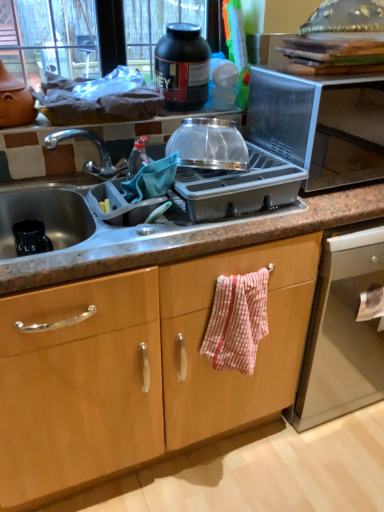
You are a GUI agent. You are given a task and a screenshot of the screen. Output one action in this format:
    pyautogui.click(x=<x>, y=<y>)
    Task: Click on the red and white checkered fabric at center
    The width and height of the screenshot is (384, 512).
    Given the screenshot: What is the action you would take?
    pyautogui.click(x=237, y=321)

Measure the distance between point (211,143) and camera.

A distance of 1.14 meters exists between point (211,143) and camera.

What is the approximate height of transparent plastic microwave at upper right?

transparent plastic microwave at upper right is 34.13 centimeters in height.

The image size is (384, 512). Identify the location of transparent plastic microwave at upper right. (320, 125).

Identify the location of red and white checkered fabric at center. Image resolution: width=384 pixels, height=512 pixels. (237, 321).

In the scene shown: From a real-world perspective, does black plastic jar at upper center, positioned as the 2th kitchen appliance in bottom-to-top order, sit lower than red and white checkered fabric at center?

Actually, black plastic jar at upper center, positioned as the 2th kitchen appliance in bottom-to-top order, is physically above red and white checkered fabric at center in the real world.

How different are the orientations of black plastic jar at upper center, the first kitchen appliance positioned from the back, and red and white checkered fabric at center in degrees?

1.8 degrees separate the facing orientations of black plastic jar at upper center, the first kitchen appliance positioned from the back, and red and white checkered fabric at center.

Could you tell me if black plastic jar at upper center, which ranks as the second kitchen appliance in front-to-back order, is facing red and white checkered fabric at center?

No, black plastic jar at upper center, which ranks as the second kitchen appliance in front-to-back order, is not aimed at red and white checkered fabric at center.

Can red and white checkered fabric at center be found inside black plastic jar at upper center, which ranks as the second kitchen appliance in front-to-back order?

Actually, red and white checkered fabric at center is outside black plastic jar at upper center, which ranks as the second kitchen appliance in front-to-back order.

From a real-world perspective, is black plastic jar at upper center, positioned as the 2th kitchen appliance in bottom-to-top order, physically located above or below granite gray sink at center?

In terms of real-world spatial position, black plastic jar at upper center, positioned as the 2th kitchen appliance in bottom-to-top order, is above granite gray sink at center.

Considering the sizes of objects black plastic jar at upper center, the first kitchen appliance viewed from the top, and granite gray sink at center in the image provided, who is taller, black plastic jar at upper center, the first kitchen appliance viewed from the top, or granite gray sink at center?

With more height is black plastic jar at upper center, the first kitchen appliance viewed from the top.

Is black plastic jar at upper center, which ranks as the second kitchen appliance in front-to-back order, facing towards granite gray sink at center?

No, black plastic jar at upper center, which ranks as the second kitchen appliance in front-to-back order, is not oriented towards granite gray sink at center.

Which is more to the left, black plastic jar at upper center, the first kitchen appliance viewed from the top, or granite gray sink at center?

From the viewer's perspective, granite gray sink at center appears more on the left side.

Considering the sizes of red and white checkered fabric at center and granite gray sink at center in the image, is red and white checkered fabric at center wider or thinner than granite gray sink at center?

Considering their sizes, red and white checkered fabric at center looks slimmer than granite gray sink at center.

Is red and white checkered fabric at center inside the boundaries of granite gray sink at center, or outside?

red and white checkered fabric at center cannot be found inside granite gray sink at center.

Who is taller, red and white checkered fabric at center or granite gray sink at center?

Standing taller between the two is red and white checkered fabric at center.

From the image's perspective, between black plastic jar at upper center, the first kitchen appliance positioned from the back, and transparent plastic bowl at upper center, the first kitchen appliance ordered from the bottom, which one is located above?

From the image's view, black plastic jar at upper center, the first kitchen appliance positioned from the back, is above.

Measure the distance between black plastic jar at upper center, positioned as the 2th kitchen appliance in bottom-to-top order, and transparent plastic bowl at upper center, the first kitchen appliance ordered from the bottom.

The distance of black plastic jar at upper center, positioned as the 2th kitchen appliance in bottom-to-top order, from transparent plastic bowl at upper center, the first kitchen appliance ordered from the bottom, is 10.14 inches.

Does black plastic jar at upper center, the first kitchen appliance viewed from the top, touch transparent plastic bowl at upper center, the second kitchen appliance in the back-to-front sequence?

There is a gap between black plastic jar at upper center, the first kitchen appliance viewed from the top, and transparent plastic bowl at upper center, the second kitchen appliance in the back-to-front sequence.

Is granite gray sink at center far away from black plastic jar at upper center, the first kitchen appliance positioned from the back?

They are positioned close to each other.

Does granite gray sink at center have a lesser width compared to black plastic jar at upper center, the first kitchen appliance viewed from the top?

No, granite gray sink at center is not thinner than black plastic jar at upper center, the first kitchen appliance viewed from the top.

From the image's perspective, is granite gray sink at center located beneath black plastic jar at upper center, which ranks as the second kitchen appliance in front-to-back order?

Yes, from the image's perspective, granite gray sink at center is beneath black plastic jar at upper center, which ranks as the second kitchen appliance in front-to-back order.

Based on the photo, can you confirm if granite gray sink at center is taller than black plastic jar at upper center, the first kitchen appliance viewed from the top?

No, granite gray sink at center is not taller than black plastic jar at upper center, the first kitchen appliance viewed from the top.

Is the position of transparent plastic microwave at upper right less distant than that of transparent plastic bowl at upper center, the second kitchen appliance in the back-to-front sequence?

No, transparent plastic microwave at upper right is further to the viewer.

Does transparent plastic microwave at upper right touch transparent plastic bowl at upper center, arranged as the 2th kitchen appliance when viewed from the top?

transparent plastic microwave at upper right and transparent plastic bowl at upper center, arranged as the 2th kitchen appliance when viewed from the top, are not in contact.

Which of these two, transparent plastic microwave at upper right or transparent plastic bowl at upper center, which is the first kitchen appliance from front to back, stands shorter?

transparent plastic bowl at upper center, which is the first kitchen appliance from front to back.

There is a transparent plastic microwave at upper right. At what (x,y) coordinates should I click in order to perform the action: click on the 1st kitchen appliance above it (from a real-world perspective). Please return your answer as a coordinate pair (x, y). The image size is (384, 512). Looking at the image, I should click on (208, 145).

Is transparent plastic microwave at upper right in contact with granite gray sink at center?

No, transparent plastic microwave at upper right is not next to granite gray sink at center.

Measure the distance from transparent plastic microwave at upper right to granite gray sink at center.

A distance of 15.97 inches exists between transparent plastic microwave at upper right and granite gray sink at center.

Considering the sizes of objects transparent plastic microwave at upper right and granite gray sink at center in the image provided, who is bigger, transparent plastic microwave at upper right or granite gray sink at center?

granite gray sink at center is bigger.

Considering the relative positions of transparent plastic microwave at upper right and granite gray sink at center in the image provided, is transparent plastic microwave at upper right behind granite gray sink at center?

Yes, transparent plastic microwave at upper right is further from the camera.

Find the location of a particular element. Image resolution: width=384 pixels, height=512 pixels. hand towel that is below the black plastic jar at upper center, which ranks as the second kitchen appliance in front-to-back order (from the image's perspective) is located at coordinates (237, 321).

Locate an element on the screen. The height and width of the screenshot is (512, 384). countertop in front of the black plastic jar at upper center, the first kitchen appliance positioned from the back is located at coordinates (192, 241).

Considering their positions, is red and white checkered fabric at center positioned closer to transparent plastic bowl at upper center, the second kitchen appliance in the back-to-front sequence, than black plastic jar at upper center, which ranks as the second kitchen appliance in front-to-back order?

black plastic jar at upper center, which ranks as the second kitchen appliance in front-to-back order, is closer to transparent plastic bowl at upper center, the second kitchen appliance in the back-to-front sequence.

When comparing their distances from transparent plastic bowl at upper center, arranged as the 2th kitchen appliance when viewed from the top, does granite gray sink at center or transparent plastic microwave at upper right seem closer?

Based on the image, granite gray sink at center appears to be nearer to transparent plastic bowl at upper center, arranged as the 2th kitchen appliance when viewed from the top.

From the image, which object appears to be farther from granite gray sink at center, black plastic jar at upper center, which ranks as the second kitchen appliance in front-to-back order, or transparent plastic microwave at upper right?

Based on the image, black plastic jar at upper center, which ranks as the second kitchen appliance in front-to-back order, appears to be further to granite gray sink at center.

Based on their spatial positions, is granite gray sink at center or black plastic jar at upper center, which ranks as the second kitchen appliance in front-to-back order, further from transparent plastic microwave at upper right?

Among the two, black plastic jar at upper center, which ranks as the second kitchen appliance in front-to-back order, is located further to transparent plastic microwave at upper right.

Consider the image. Which object lies nearer to the anchor point transparent plastic bowl at upper center, arranged as the 2th kitchen appliance when viewed from the top, black plastic jar at upper center, positioned as the 2th kitchen appliance in bottom-to-top order, or granite gray sink at center?

The object closer to transparent plastic bowl at upper center, arranged as the 2th kitchen appliance when viewed from the top, is black plastic jar at upper center, positioned as the 2th kitchen appliance in bottom-to-top order.

Estimate the real-world distances between objects in this image. Which object is further from red and white checkered fabric at center, black plastic jar at upper center, the first kitchen appliance positioned from the back, or transparent plastic bowl at upper center, which is the first kitchen appliance from front to back?

black plastic jar at upper center, the first kitchen appliance positioned from the back, is positioned further to the anchor red and white checkered fabric at center.

Based on their spatial positions, is transparent plastic microwave at upper right or red and white checkered fabric at center closer to transparent plastic bowl at upper center, arranged as the 2th kitchen appliance when viewed from the top?

Among the two, transparent plastic microwave at upper right is located nearer to transparent plastic bowl at upper center, arranged as the 2th kitchen appliance when viewed from the top.

When comparing their distances from transparent plastic bowl at upper center, the second kitchen appliance in the back-to-front sequence, does red and white checkered fabric at center or granite gray sink at center seem closer?

Among the two, granite gray sink at center is located nearer to transparent plastic bowl at upper center, the second kitchen appliance in the back-to-front sequence.

Locate an element on the screen. The width and height of the screenshot is (384, 512). kitchen appliance between black plastic jar at upper center, the first kitchen appliance viewed from the top, and red and white checkered fabric at center from top to bottom is located at coordinates (208, 145).

Locate an element on the screen. The width and height of the screenshot is (384, 512). appliance that lies between black plastic jar at upper center, the first kitchen appliance viewed from the top, and red and white checkered fabric at center from top to bottom is located at coordinates (320, 125).

Find the location of a particular element. This screenshot has width=384, height=512. kitchen appliance between black plastic jar at upper center, which ranks as the second kitchen appliance in front-to-back order, and granite gray sink at center from top to bottom is located at coordinates (208, 145).

Where is `countertop that lies between black plastic jar at upper center, the first kitchen appliance viewed from the top, and red and white checkered fabric at center from top to bottom`? countertop that lies between black plastic jar at upper center, the first kitchen appliance viewed from the top, and red and white checkered fabric at center from top to bottom is located at coordinates click(192, 241).